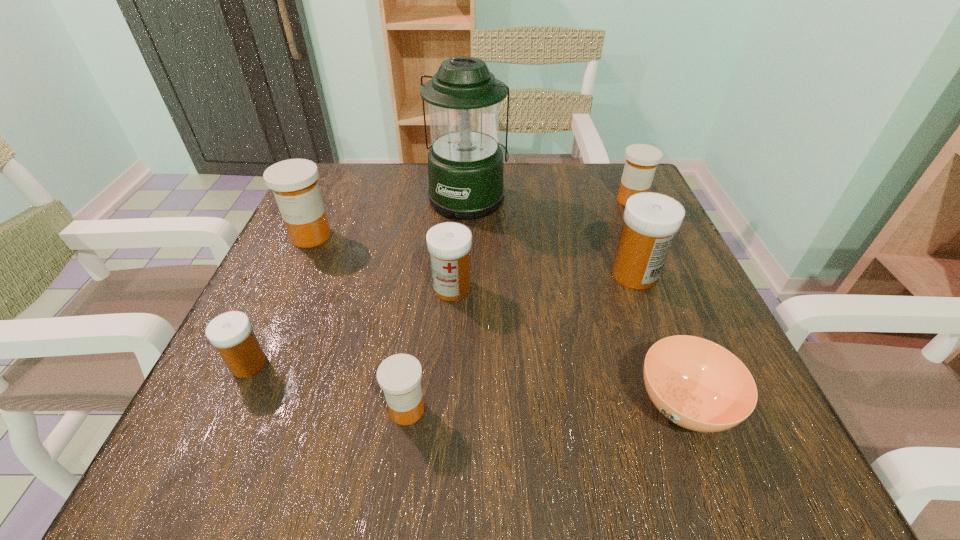
This screenshot has height=540, width=960. I want to click on orange medicine that stands as the third closest to the nearest white medicine, so click(641, 162).

Identify the location of orange medicine identified as the second closest to the soup bowl. (641, 162).

I want to click on white medicine object that ranks as the third closest to the second smallest orange medicine, so click(x=231, y=333).

Choose which white medicine is the nearest neighbor to the second nearest medicine. Please provide its 2D coordinates. Your answer should be formatted as a tuple, i.e. [(x, y)], where the tuple contains the x and y coordinates of a point satisfying the conditions above.

[(449, 243)]

Identify the location of vacant region that satisfies the following two spatial constraints: 1. on the back side of the nearest white medicine; 2. on the left side of the second white medicine from right to left. The width and height of the screenshot is (960, 540). (284, 288).

You are a GUI agent. You are given a task and a screenshot of the screen. Output one action in this format:
    pyautogui.click(x=<x>, y=<y>)
    Task: Click on the vacant space that satisfies the following two spatial constraints: 1. on the label of the farthest medicine; 2. on the front side of the fifth farthest medicine
    This screenshot has width=960, height=540.
    Given the screenshot: What is the action you would take?
    pyautogui.click(x=706, y=364)

Find the location of a particular element. This screenshot has height=540, width=960. vacant space that satisfies the following two spatial constraints: 1. on the label of the rightmost orange medicine; 2. on the front side of the rightmost white medicine is located at coordinates (664, 274).

Where is `vacant space that satisfies the following two spatial constraints: 1. on the label of the sixth nearest object; 2. on the left side of the shortest object`? This screenshot has width=960, height=540. vacant space that satisfies the following two spatial constraints: 1. on the label of the sixth nearest object; 2. on the left side of the shortest object is located at coordinates pos(234,404).